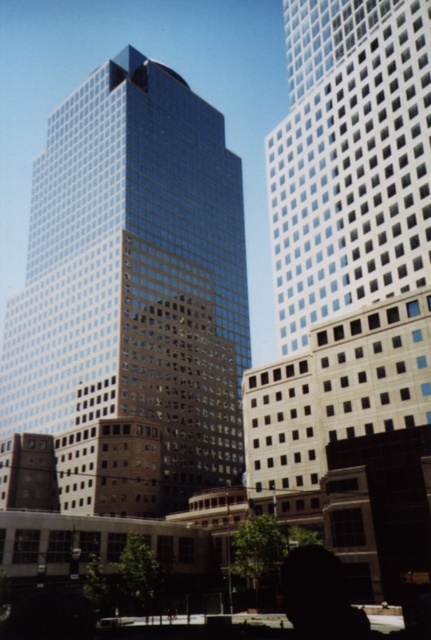
Question: Does glassy reflective skyscraper at center have a smaller size compared to white glass building at upper right?

Choices:
 (A) no
 (B) yes

Answer: (A)

Question: Is glassy reflective skyscraper at center bigger than white glass building at upper right?

Choices:
 (A) no
 (B) yes

Answer: (B)

Question: Considering the relative positions of glassy reflective skyscraper at center and white glass building at upper right in the image provided, where is glassy reflective skyscraper at center located with respect to white glass building at upper right?

Choices:
 (A) right
 (B) left

Answer: (B)

Question: Which point is closer to the camera?

Choices:
 (A) white glass building at upper right
 (B) glassy reflective skyscraper at center

Answer: (A)

Question: Which point is farther to the camera?

Choices:
 (A) (128, 195)
 (B) (287, 198)

Answer: (A)